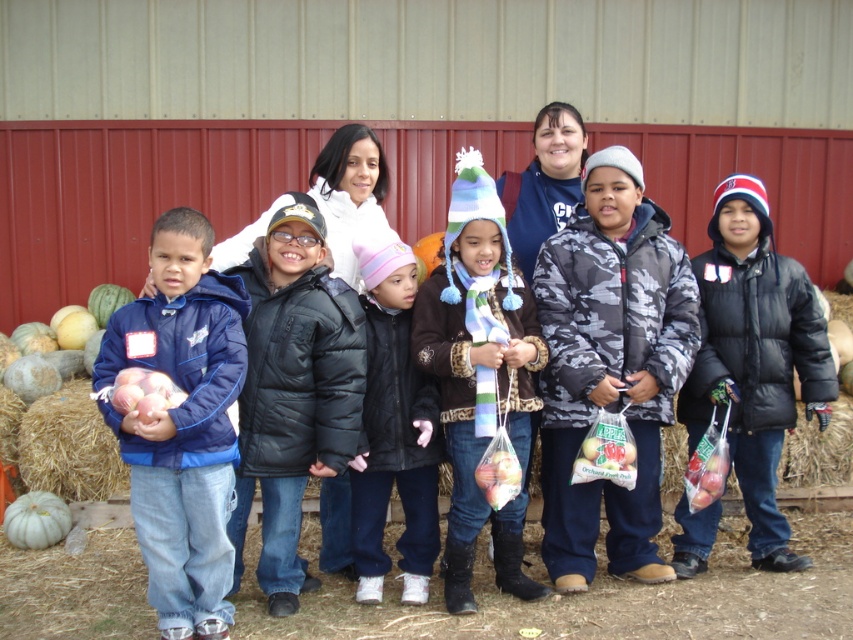
You are a photographer trying to capture a group photo of the children and adults. You need to ensure that the camouflage jacket at center and the brown straw bale at lower left are both visible in the shot. Which object should be placed closer to the camera to ensure both are fully visible?

The camouflage jacket at center should be placed closer to the camera because it is taller than the brown straw bale at lower left. This way, the taller object will not block the view of the shorter one.

You are a photographer trying to capture a photo of the camouflage jacket at center and the black quilted jacket at center. Which jacket should you focus on first if you want to ensure both are in focus, given that your camera can only focus on one at a time?

The camouflage jacket at center is above the black quilted jacket at center, so you should focus on the camouflage jacket at center first as it is closer to the camera.